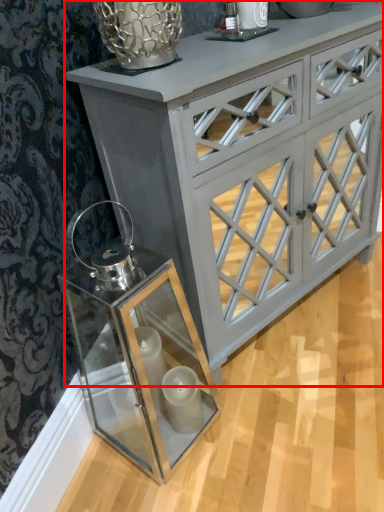
Question: In this image, where is chest of drawers (annotated by the red box) located relative to glass box?

Choices:
 (A) right
 (B) left

Answer: (A)